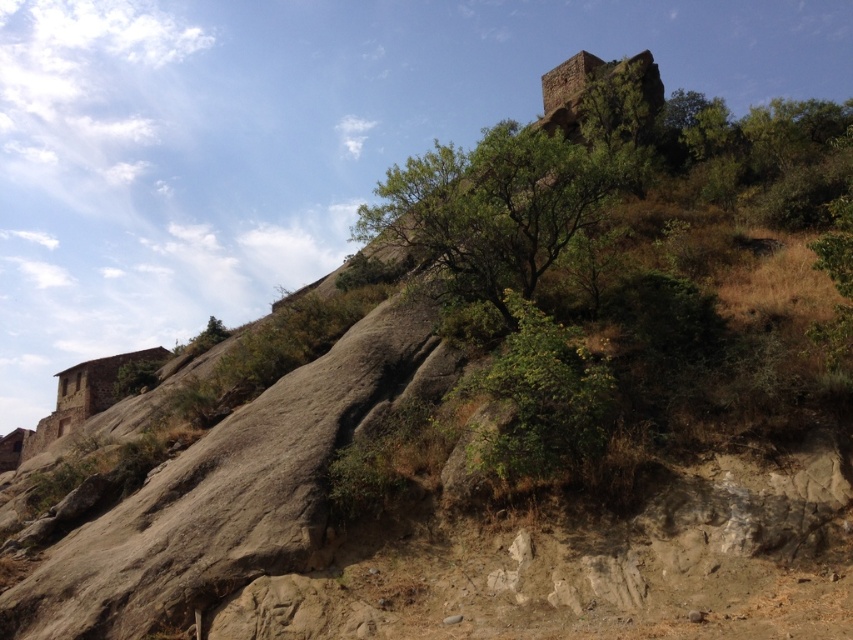
Does point (401, 200) come closer to viewer compared to point (524, 436)?

No, it is not.

Which is below, green leafy tree at center or green leafy bush at center?

green leafy bush at center is below.

Locate an element on the screen. green leafy tree at center is located at coordinates (489, 209).